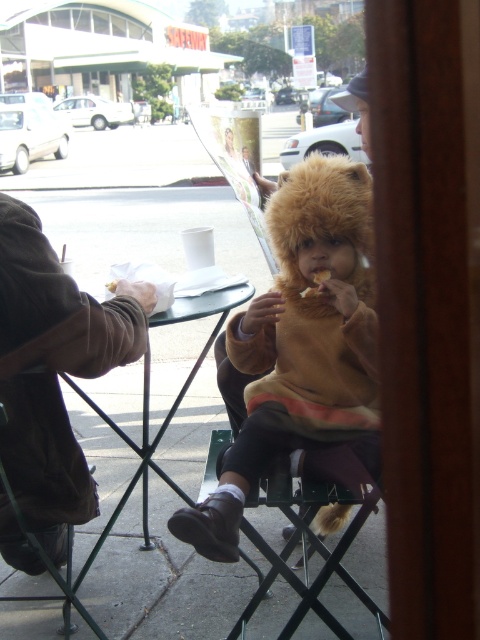
You are a delivery person who needs to place a small package on the table. The package is 10 cm wide. The table has the fuzzy brown hat at center and the brown leather jacket at left on it. Can you fit the package between them?

The fuzzy brown hat at center has a lesser width compared to brown leather jacket at left, so there might be enough space between them to fit the 10 cm wide package. However, the exact placement depends on their arrangement.

You are standing at the center of the image and want to hand a napkin to the person wearing the brown leather jacket at left. In which direction should you move to reach them?

Since the brown leather jacket at left is positioned at point 0.583 on the x axis and 0.108 on the y axis, you should move to the left and slightly downward to reach them.